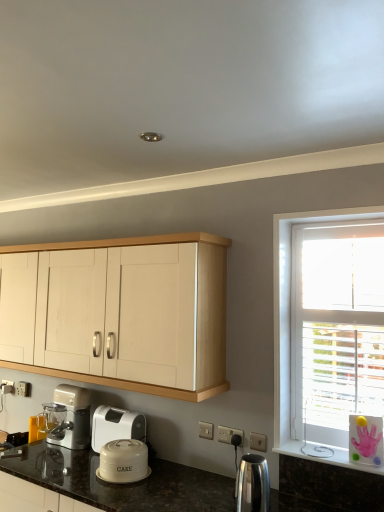
Question: Considering the relative sizes of polished stainless steel kettle at lower center, the first kitchen appliance in the front-to-back sequence, and white plastic electric outlet at lower center in the image provided, is polished stainless steel kettle at lower center, the first kitchen appliance in the front-to-back sequence, bigger than white plastic electric outlet at lower center?

Choices:
 (A) yes
 (B) no

Answer: (A)

Question: Is polished stainless steel kettle at lower center, acting as the 1th kitchen appliance starting from the right, shorter than white plastic electric outlet at lower center?

Choices:
 (A) yes
 (B) no

Answer: (B)

Question: Is the surface of polished stainless steel kettle at lower center, acting as the 1th kitchen appliance starting from the right, in direct contact with white plastic electric outlet at lower center?

Choices:
 (A) no
 (B) yes

Answer: (A)

Question: From a real-world perspective, is polished stainless steel kettle at lower center, acting as the 1th kitchen appliance starting from the right, beneath white plastic electric outlet at lower center?

Choices:
 (A) no
 (B) yes

Answer: (B)

Question: Considering the relative sizes of polished stainless steel kettle at lower center, which appears as the second kitchen appliance when viewed from the left, and white plastic electric outlet at lower center in the image provided, is polished stainless steel kettle at lower center, which appears as the second kitchen appliance when viewed from the left, wider than white plastic electric outlet at lower center?

Choices:
 (A) no
 (B) yes

Answer: (B)

Question: Could you tell me if polished stainless steel kettle at lower center, which appears as the second kitchen appliance when viewed from the left, is turned towards white plastic electric outlet at lower center?

Choices:
 (A) yes
 (B) no

Answer: (B)

Question: Can you confirm if polished stainless steel kettle at lower center, acting as the 1th kitchen appliance starting from the right, is shorter than light wood cabinet at upper center?

Choices:
 (A) no
 (B) yes

Answer: (B)

Question: Is the depth of polished stainless steel kettle at lower center, acting as the 2th kitchen appliance starting from the back, greater than that of light wood cabinet at upper center?

Choices:
 (A) no
 (B) yes

Answer: (A)

Question: Can you confirm if polished stainless steel kettle at lower center, acting as the 1th kitchen appliance starting from the right, is smaller than light wood cabinet at upper center?

Choices:
 (A) yes
 (B) no

Answer: (A)

Question: Considering the relative sizes of polished stainless steel kettle at lower center, which appears as the second kitchen appliance when viewed from the left, and light wood cabinet at upper center in the image provided, is polished stainless steel kettle at lower center, which appears as the second kitchen appliance when viewed from the left, taller than light wood cabinet at upper center?

Choices:
 (A) no
 (B) yes

Answer: (A)

Question: Considering the relative sizes of polished stainless steel kettle at lower center, which appears as the second kitchen appliance when viewed from the left, and light wood cabinet at upper center in the image provided, is polished stainless steel kettle at lower center, which appears as the second kitchen appliance when viewed from the left, wider than light wood cabinet at upper center?

Choices:
 (A) yes
 (B) no

Answer: (B)

Question: From a real-world perspective, is polished stainless steel kettle at lower center, acting as the 2th kitchen appliance starting from the back, physically below light wood cabinet at upper center?

Choices:
 (A) yes
 (B) no

Answer: (A)

Question: Is matte white cake container at lower center, arranged as the 2th kitchen appliance when viewed from the right, outside polished stainless steel kettle at lower center, the first kitchen appliance in the front-to-back sequence?

Choices:
 (A) yes
 (B) no

Answer: (A)